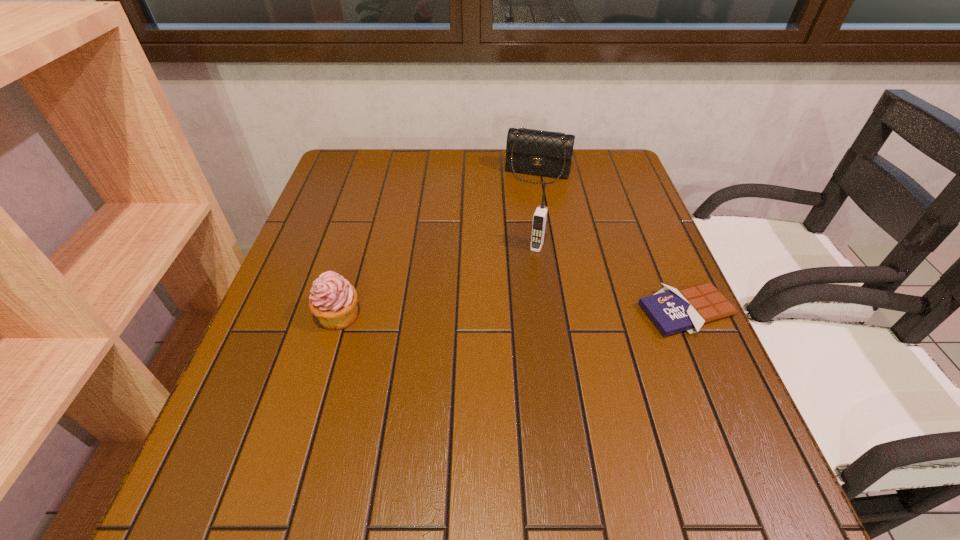
Image resolution: width=960 pixels, height=540 pixels. I want to click on the closest object to the leftmost object, so [x=540, y=216].

Locate which object is the closest to the cellular telephone. Please provide its 2D coordinates. Your answer should be formatted as a tuple, i.e. [(x, y)], where the tuple contains the x and y coordinates of a point satisfying the conditions above.

[(672, 311)]

The width and height of the screenshot is (960, 540). I want to click on free space in the image that satisfies the following two spatial constraints: 1. on the back side of the leftmost object; 2. on the right side of the chocolate bar, so click(x=340, y=312).